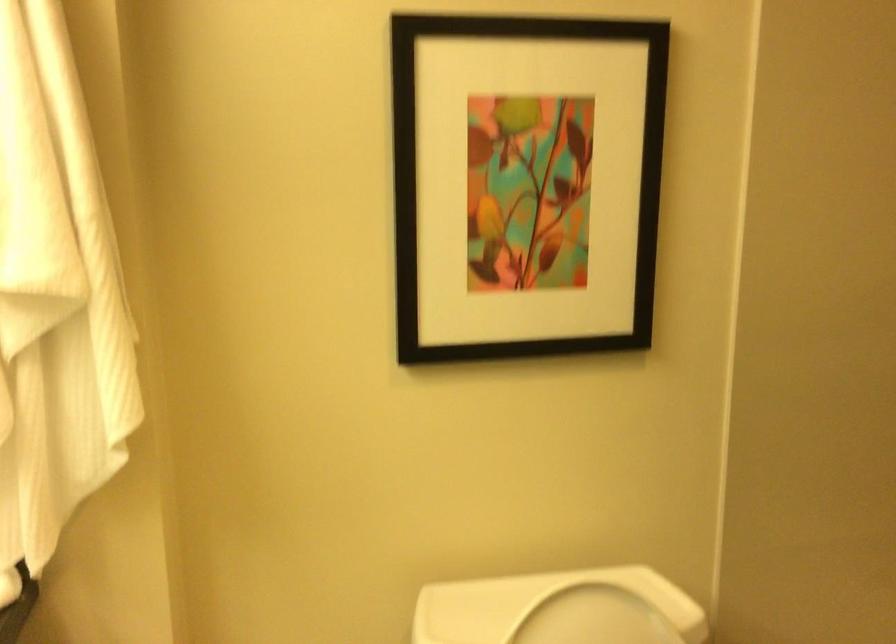
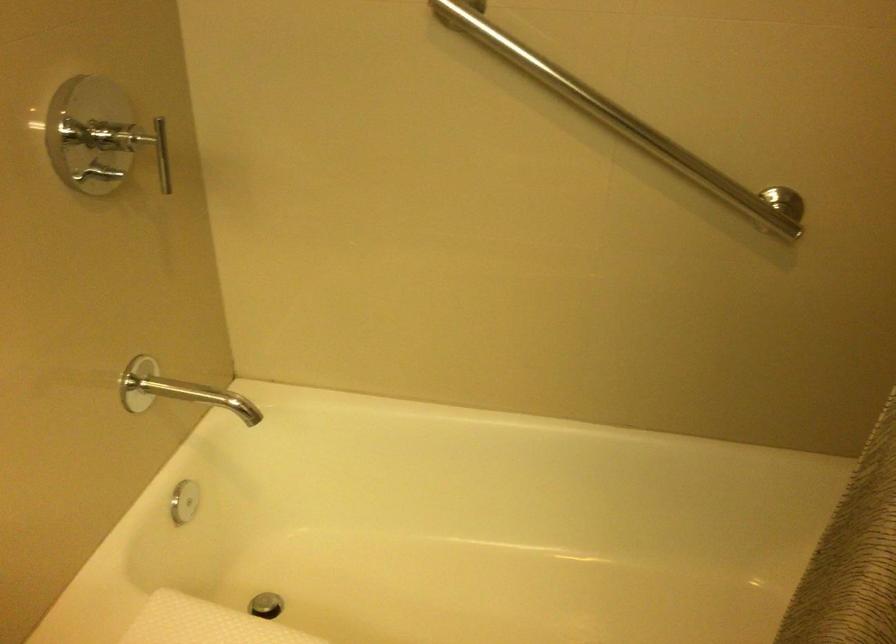
First-person continuous shooting, in which direction is the camera rotating?

The camera rotated toward right-down.